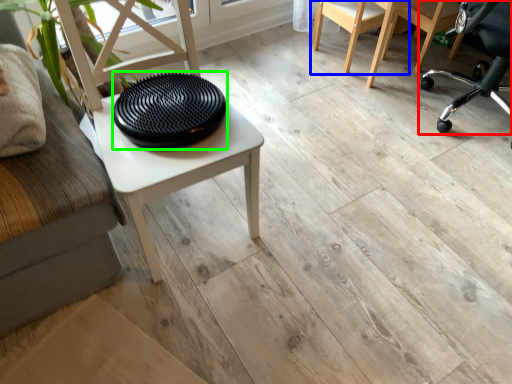
Question: Which object is the farthest from chair (highlighted by a red box)? Choose among these: chair (highlighted by a blue box) or tray (highlighted by a green box).

Choices:
 (A) chair
 (B) tray

Answer: (B)